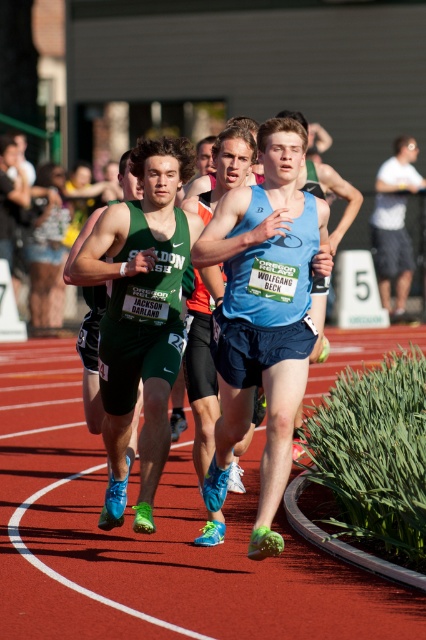
Question: Observing the image, what is the correct spatial positioning of red rubber track at center in reference to white cotton shirt at right?

Choices:
 (A) right
 (B) left

Answer: (B)

Question: Which point is closer to the camera?

Choices:
 (A) (195, 618)
 (B) (166, 147)

Answer: (A)

Question: Which point appears farthest from the camera in this image?

Choices:
 (A) (377, 224)
 (B) (143, 180)
 (C) (2, 627)

Answer: (A)

Question: Among these points, which one is farthest from the camera?

Choices:
 (A) (290, 147)
 (B) (71, 605)
 (C) (385, 291)
 (D) (143, 454)

Answer: (C)

Question: Can you confirm if blue matte tank top at center is bigger than green matte shorts at center?

Choices:
 (A) yes
 (B) no

Answer: (A)

Question: Can you confirm if red rubber track at center is positioned above white cotton shirt at right?

Choices:
 (A) no
 (B) yes

Answer: (A)